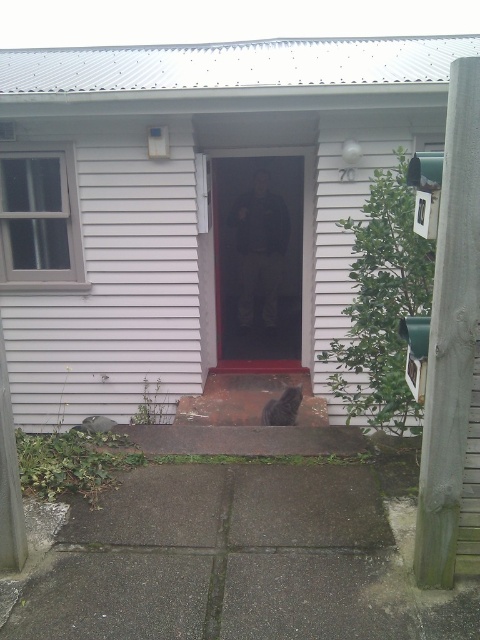
Can you confirm if transparent plastic screen door at center is positioned above black fur cat at center?

Yes, transparent plastic screen door at center is above black fur cat at center.

Does transparent plastic screen door at center come in front of black fur cat at center?

That is False.

The height and width of the screenshot is (640, 480). In order to click on transparent plastic screen door at center in this screenshot , I will do `click(257, 257)`.

At what (x,y) coordinates should I click in order to perform the action: click on transparent plastic screen door at center. Please return your answer as a coordinate pair (x, y). This screenshot has height=640, width=480. Looking at the image, I should click on (257, 257).